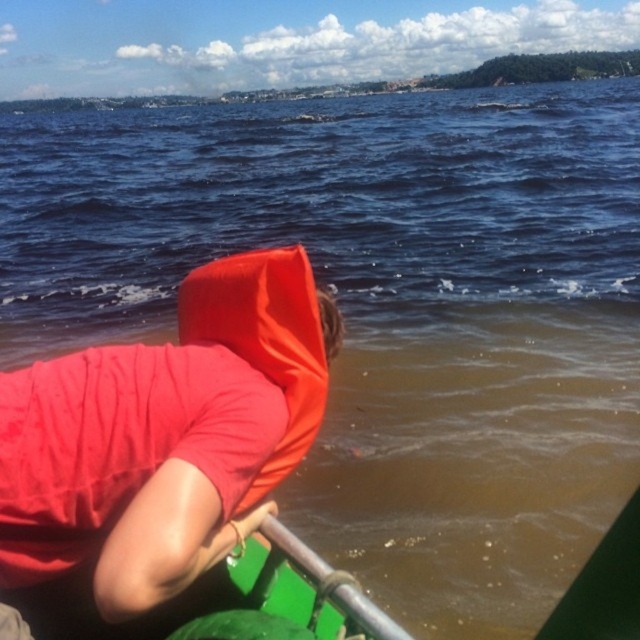
You are a photographer trying to capture the matte red life vest at left and the matte orange life jacket at center in a single shot. Since you want both objects to be in focus, which one should you adjust your camera focus towards first?

You should focus on the matte red life vest at left first because it is closer to the viewer than the matte orange life jacket at center. By focusing on the closer object, the farther one may still be within the depth of field, ensuring both are in focus.

You are a lifeguard on duty and see two life preservers in the water. The scene shows a matte red life vest at left and a matte orange life jacket at center. Which one is taller?

The matte red life vest at left is taller than the matte orange life jacket at center.

You are navigating a kayak and need to locate your safety gear. Based on the scene, where is the matte red life vest at left positioned relative to the kayak?

The matte red life vest at left is located at point 0.667 on the x axis and 0.261 on the y axis relative to the kayak.